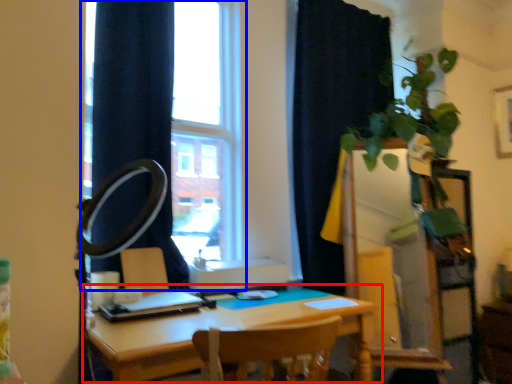
Question: Which point is closer to the camera, table (highlighted by a red box) or window (highlighted by a blue box)?

Choices:
 (A) table
 (B) window

Answer: (A)